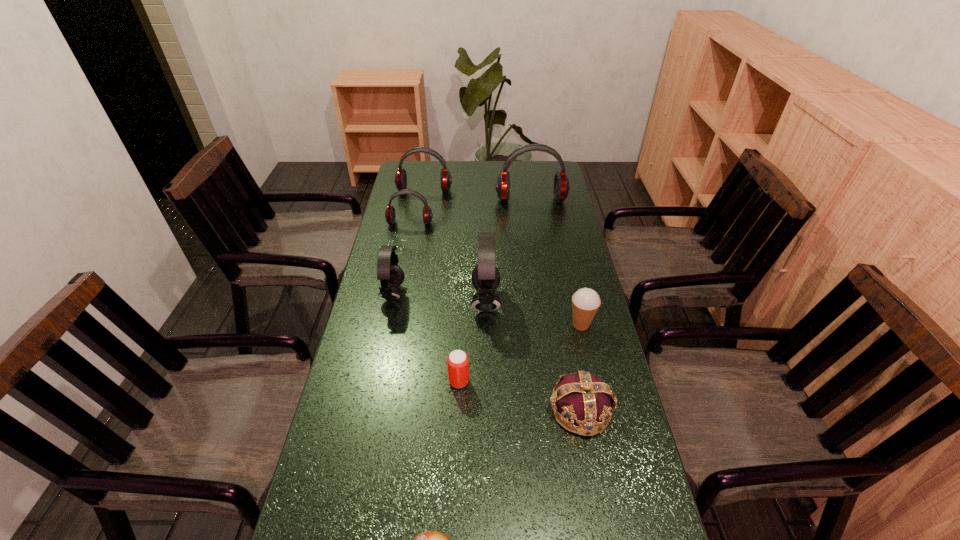
Locate an element on the screen. The height and width of the screenshot is (540, 960). empty space between the biggest red earphone and the icecream is located at coordinates (556, 262).

The image size is (960, 540). Identify the location of free point between the smaller black earphone and the smallest red earphone. (401, 259).

At what (x,y) coordinates should I click in order to perform the action: click on free space between the biggest red earphone and the left black earphone. Please return your answer as a coordinate pair (x, y). Image resolution: width=960 pixels, height=540 pixels. Looking at the image, I should click on (462, 247).

Where is `vacant space that's between the icecream and the biggest red earphone`? vacant space that's between the icecream and the biggest red earphone is located at coordinates (556, 262).

Identify the location of object that stands as the fifth closest to the purple crown. (389, 273).

Locate an element on the screen. The image size is (960, 540). object that ranks as the second closest to the left black earphone is located at coordinates (457, 361).

Select which earphone appears as the fifth closest to the apple. Please provide its 2D coordinates. Your answer should be formatted as a tuple, i.e. [(x, y)], where the tuple contains the x and y coordinates of a point satisfying the conditions above.

[(400, 179)]

Locate which earphone is the second closest to the shortest object. Please provide its 2D coordinates. Your answer should be formatted as a tuple, i.e. [(x, y)], where the tuple contains the x and y coordinates of a point satisfying the conditions above.

[(389, 273)]

Locate an element on the screen. This screenshot has width=960, height=540. red earphone identified as the third closest to the red beer can is located at coordinates (400, 179).

Identify which red earphone is located as the third nearest to the icecream. Please provide its 2D coordinates. Your answer should be formatted as a tuple, i.e. [(x, y)], where the tuple contains the x and y coordinates of a point satisfying the conditions above.

[(400, 179)]